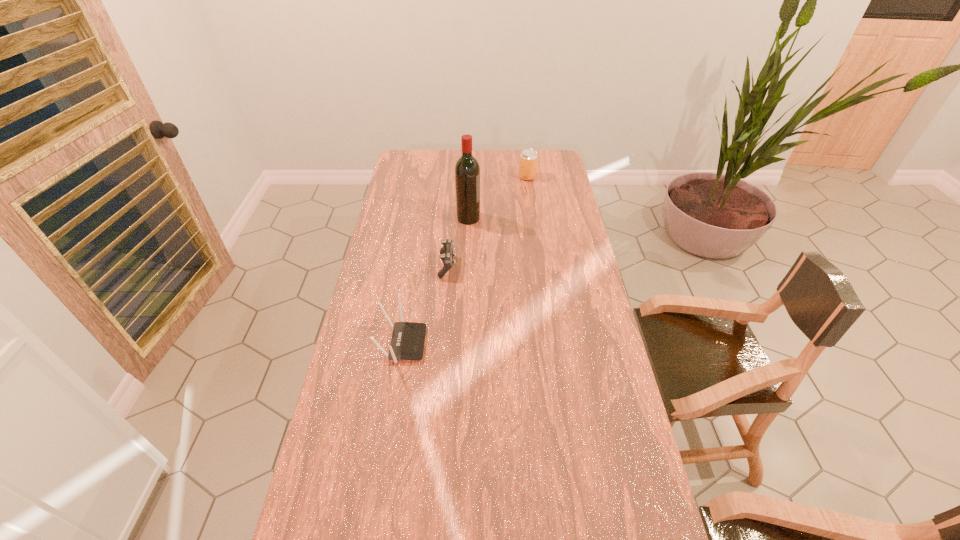
Locate an element on the screen. The image size is (960, 540). vacant region between the router and the second nearest object is located at coordinates (425, 305).

Locate an element on the screen. This screenshot has height=540, width=960. vacant space that is in between the third nearest object and the nearest object is located at coordinates (436, 281).

At what (x,y) coordinates should I click in order to perform the action: click on free space between the control and the third nearest object. Please return your answer as a coordinate pair (x, y). This screenshot has height=540, width=960. Looking at the image, I should click on (458, 242).

Locate an element on the screen. free space between the rightmost object and the leftmost object is located at coordinates (465, 260).

Find the location of a particular element. vacant space that is in between the second farthest object and the leftmost object is located at coordinates (436, 281).

Locate an element on the screen. This screenshot has height=540, width=960. vacant space that's between the wine bottle and the leftmost object is located at coordinates (436, 281).

The height and width of the screenshot is (540, 960). Identify the location of object that stands as the second closest to the wine bottle. (528, 158).

Select which object is the closest to the farthest object. Please provide its 2D coordinates. Your answer should be formatted as a tuple, i.e. [(x, y)], where the tuple contains the x and y coordinates of a point satisfying the conditions above.

[(467, 170)]

This screenshot has height=540, width=960. What are the coordinates of `vacant space that satisfies the following two spatial constraints: 1. on the front side of the pop (soda); 2. on the front-facing side of the router` in the screenshot? It's located at (552, 343).